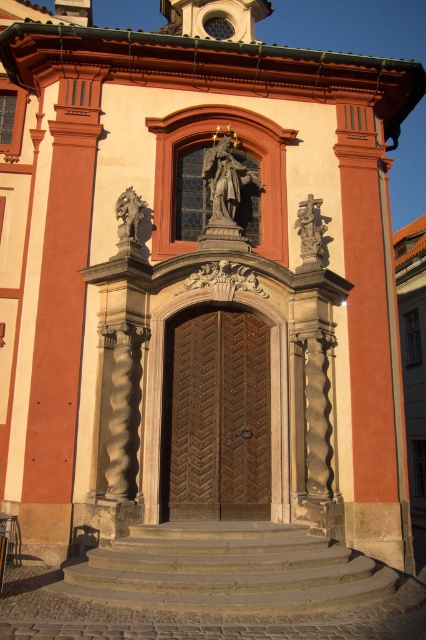
Based on the photo, you are an art student visiting the historic building. You want to know which statue is taller between the polished bronze statue at upper center and the polished stone statue at right. Can you tell me based on their positions?

The polished bronze statue at upper center is much taller than the polished stone statue at right.

You are standing at the entrance of the historic building and want to touch both the wooden door at center and the polished stone statue at right. Which one can you reach first without moving your position?

The wooden door at center is closer to the viewer than the polished stone statue at right, so you can reach the wooden door at center first without moving.

You are standing at the entrance of the historic building and want to locate the wooden door at center. Based on the coordinates provided, can you determine its exact position relative to the image frame?

The wooden door at center is located at coordinates point (x=216, y=417), which means it is positioned 65.2 percent from the left edge and 50.9 percent from the bottom edge of the image frame.